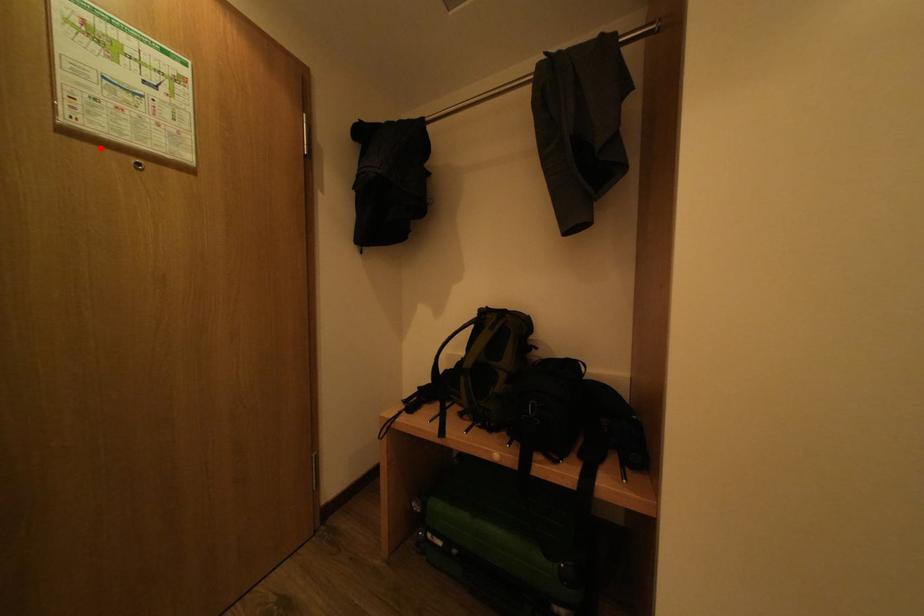
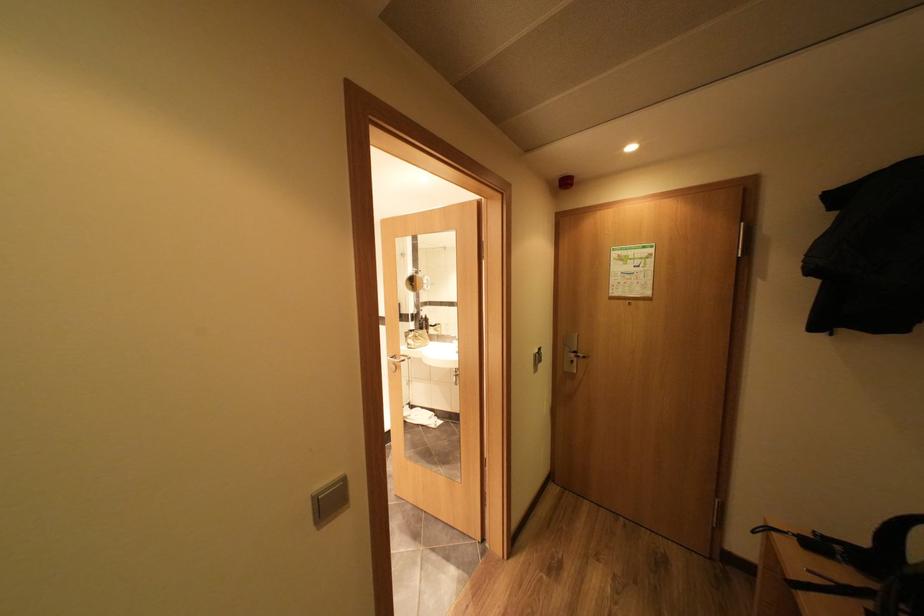
Question: I am providing you with two images of the same scene from different viewpoints. A red point is marked on the first image. Is the red point's position out of view in image 2?

Choices:
 (A) Yes
 (B) No

Answer: (B)